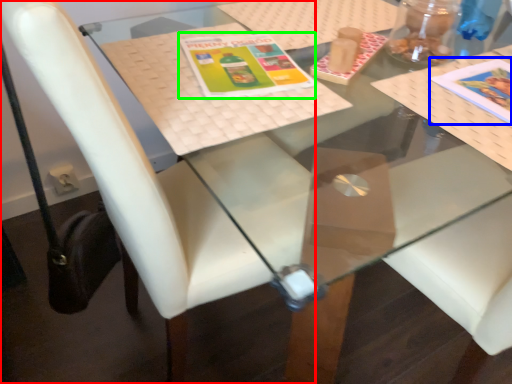
Question: Estimate the real-world distances between objects in this image. Which object is closer to chair (highlighted by a red box), book cover (highlighted by a blue box) or book cover (highlighted by a green box)?

Choices:
 (A) book cover
 (B) book cover

Answer: (B)